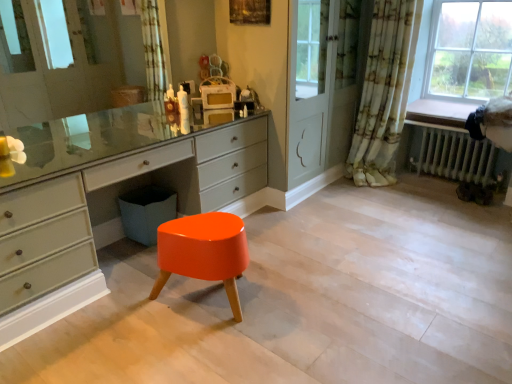
Identify the location of empty space that is to the right of matte gray chest of drawers at center. The image size is (512, 384). (348, 266).